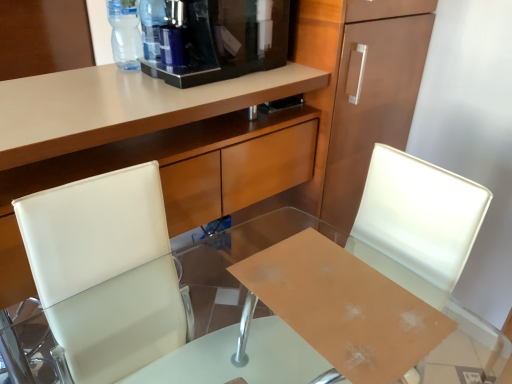
Locate an element on the screen. The width and height of the screenshot is (512, 384). free space above matte wood cabinet at upper center (from a real-world perspective) is located at coordinates (139, 90).